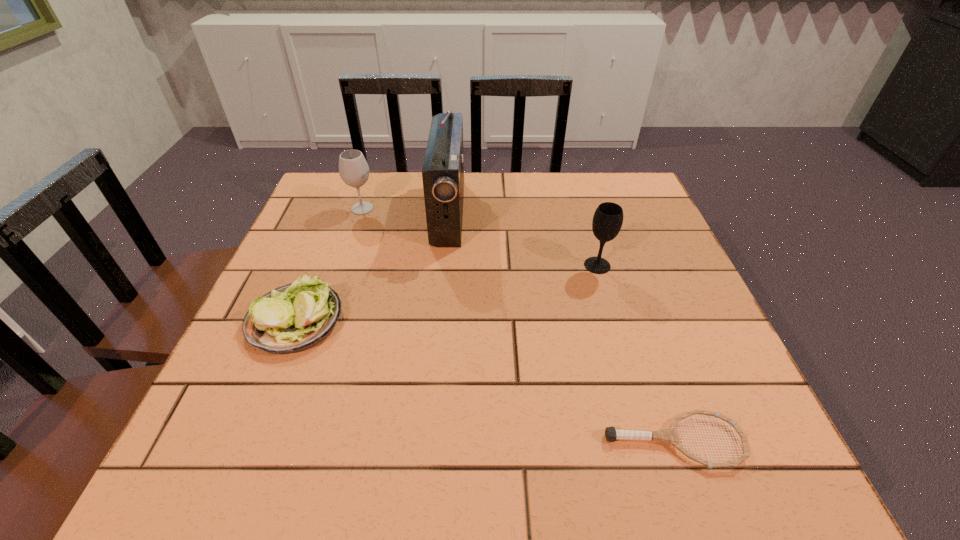
What are the coordinates of `tennis racket present at the right edge` in the screenshot? It's located at (669, 435).

This screenshot has width=960, height=540. What are the coordinates of `object at the far left corner` in the screenshot? It's located at (353, 169).

The image size is (960, 540). In order to click on object that is at the near right corner in this screenshot , I will do `click(669, 435)`.

In the image, there is a desktop. At what (x,y) coordinates should I click in order to perform the action: click on vacant space at the far edge. Please return your answer as a coordinate pair (x, y). The height and width of the screenshot is (540, 960). Looking at the image, I should click on coord(385,198).

Identify the location of free space at the near edge. The width and height of the screenshot is (960, 540). (522, 464).

In the image, there is a desktop. In order to click on vacant area at the left edge in this screenshot , I will do `click(344, 225)`.

I want to click on blank space at the right edge of the desktop, so click(x=624, y=299).

You are a GUI agent. You are given a task and a screenshot of the screen. Output one action in this format:
    pyautogui.click(x=<x>, y=<y>)
    Task: Click on the blank area at the near left corner
    The width and height of the screenshot is (960, 540).
    Given the screenshot: What is the action you would take?
    pyautogui.click(x=213, y=463)

This screenshot has width=960, height=540. Find the location of `free spot between the left wineglass and the tennis racket`. free spot between the left wineglass and the tennis racket is located at coordinates (518, 325).

You are a GUI agent. You are given a task and a screenshot of the screen. Output one action in this format:
    pyautogui.click(x=<x>, y=<y>)
    Task: Click on the vacant region between the nearest object and the tallest object
    
    Given the screenshot: What is the action you would take?
    pyautogui.click(x=562, y=327)